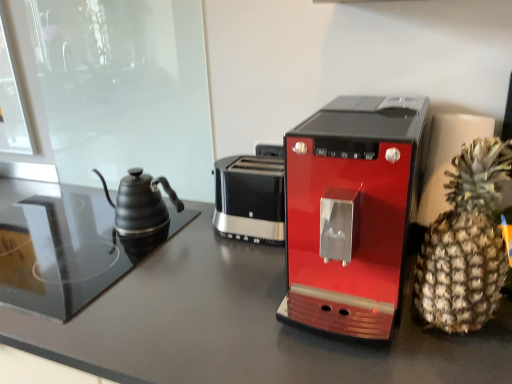
Question: Is matte black kettle at left to the left of brown spiky pineapple at right from the viewer's perspective?

Choices:
 (A) yes
 (B) no

Answer: (A)

Question: Is matte black kettle at left wider than brown spiky pineapple at right?

Choices:
 (A) yes
 (B) no

Answer: (B)

Question: Is brown spiky pineapple at right a part of matte black kettle at left?

Choices:
 (A) no
 (B) yes

Answer: (A)

Question: Does matte black kettle at left have a lesser width compared to brown spiky pineapple at right?

Choices:
 (A) no
 (B) yes

Answer: (B)

Question: Is matte black kettle at left positioned behind brown spiky pineapple at right?

Choices:
 (A) no
 (B) yes

Answer: (B)

Question: From their relative heights in the image, would you say matte black kettle at left is taller or shorter than brown spiky pineapple at right?

Choices:
 (A) short
 (B) tall

Answer: (A)

Question: Considering the relative positions of matte black kettle at left and brown spiky pineapple at right in the image provided, is matte black kettle at left to the left or to the right of brown spiky pineapple at right?

Choices:
 (A) right
 (B) left

Answer: (B)

Question: Is matte black kettle at left in front of or behind brown spiky pineapple at right in the image?

Choices:
 (A) behind
 (B) front

Answer: (A)

Question: Looking at the image, does matte black kettle at left seem bigger or smaller compared to brown spiky pineapple at right?

Choices:
 (A) big
 (B) small

Answer: (B)

Question: Is brown spiky pineapple at right wider or thinner than shiny red coffee maker at center?

Choices:
 (A) thin
 (B) wide

Answer: (A)

Question: Considering the positions of brown spiky pineapple at right and shiny red coffee maker at center in the image, is brown spiky pineapple at right taller or shorter than shiny red coffee maker at center?

Choices:
 (A) tall
 (B) short

Answer: (A)

Question: From a real-world perspective, relative to shiny red coffee maker at center, is brown spiky pineapple at right vertically above or below?

Choices:
 (A) below
 (B) above

Answer: (B)

Question: Considering the relative positions of brown spiky pineapple at right and shiny red coffee maker at center in the image provided, is brown spiky pineapple at right to the left or to the right of shiny red coffee maker at center?

Choices:
 (A) left
 (B) right

Answer: (B)

Question: From a real-world perspective, is brown spiky pineapple at right physically located above or below matte black kettle at left?

Choices:
 (A) below
 (B) above

Answer: (B)

Question: Is brown spiky pineapple at right wider or thinner than matte black kettle at left?

Choices:
 (A) wide
 (B) thin

Answer: (A)